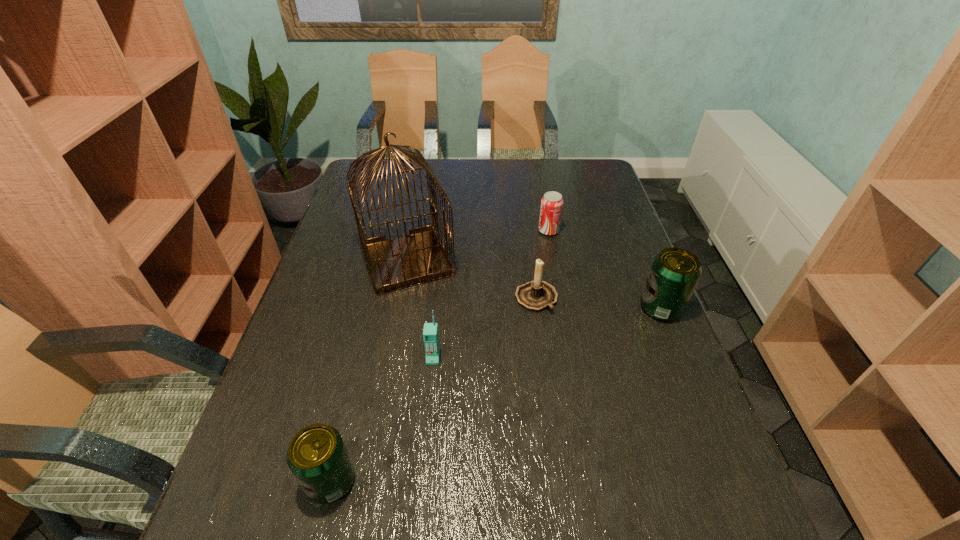
Find the location of `free space between the rightmost object and the soda can`. free space between the rightmost object and the soda can is located at coordinates (605, 269).

The height and width of the screenshot is (540, 960). In order to click on free area in between the tallest object and the candle holder in this screenshot , I will do `click(471, 279)`.

Locate an element on the screen. unoccupied area between the soda can and the farther beer can is located at coordinates 605,269.

Locate an element on the screen. This screenshot has width=960, height=540. free point between the right beer can and the nearest object is located at coordinates (495, 394).

Image resolution: width=960 pixels, height=540 pixels. I want to click on free space that is in between the tallest object and the cellular telephone, so click(x=420, y=309).

Find the location of a particular element. free space between the rightmost object and the soda can is located at coordinates (605, 269).

Find the location of a particular element. The height and width of the screenshot is (540, 960). empty location between the soda can and the fifth farthest object is located at coordinates (491, 294).

Locate an element on the screen. object that is the second nearest to the left beer can is located at coordinates (417, 258).

Find the location of `the closest object to the taller beer can`. the closest object to the taller beer can is located at coordinates (536, 295).

At what (x,y) coordinates should I click in order to perform the action: click on free space that satisfies the following two spatial constraints: 1. on the logo side of the soda can; 2. on the front side of the nearer beer can. Please return your answer as a coordinate pair (x, y). Image resolution: width=960 pixels, height=540 pixels. Looking at the image, I should click on (595, 481).